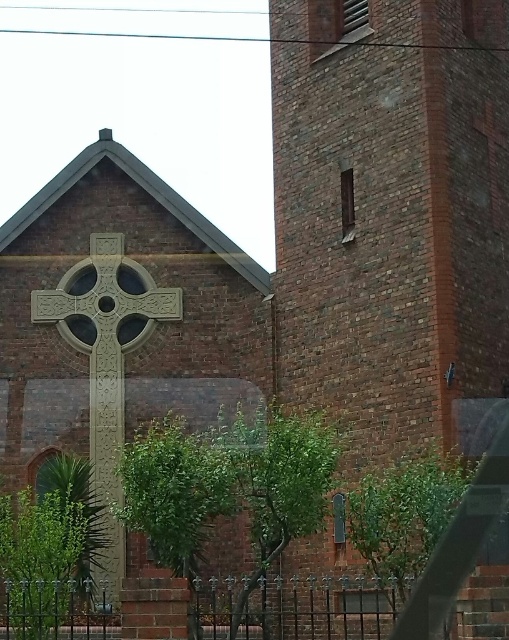
Can you confirm if brick tower at center is positioned to the left of carved stone cross at center?

No, brick tower at center is not to the left of carved stone cross at center.

Which is in front, point (473, 221) or point (126, 324)?

Point (473, 221) is in front.

Measure the distance between point [412,44] and camera.

They are 66.80 meters apart.

Image resolution: width=509 pixels, height=640 pixels. I want to click on brick tower at center, so click(390, 212).